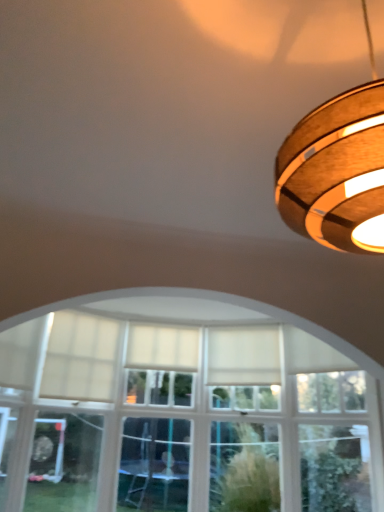
Question: From a real-world perspective, is wooden ring light at upper right physically below white fabric curtain at center, which is counted as the first curtain, starting from the right?

Choices:
 (A) yes
 (B) no

Answer: (B)

Question: From the image's perspective, is wooden ring light at upper right on top of white fabric curtain at center, the 2th curtain when ordered from left to right?

Choices:
 (A) no
 (B) yes

Answer: (B)

Question: Does wooden ring light at upper right have a greater width compared to white fabric curtain at center, the 2th curtain when ordered from left to right?

Choices:
 (A) yes
 (B) no

Answer: (A)

Question: Can you confirm if wooden ring light at upper right is positioned to the left of white fabric curtain at center, which is counted as the first curtain, starting from the right?

Choices:
 (A) no
 (B) yes

Answer: (A)

Question: Does wooden ring light at upper right have a smaller size compared to white fabric curtain at center, the 2th curtain when ordered from left to right?

Choices:
 (A) no
 (B) yes

Answer: (A)

Question: Is white fabric curtain at center, the 2th curtain when ordered from left to right, inside or outside of wooden ring light at upper right?

Choices:
 (A) inside
 (B) outside

Answer: (B)

Question: Based on their sizes in the image, would you say white fabric curtain at center, which is counted as the first curtain, starting from the right, is bigger or smaller than wooden ring light at upper right?

Choices:
 (A) big
 (B) small

Answer: (B)

Question: Would you say white fabric curtain at center, the 2th curtain when ordered from left to right, is to the left or to the right of wooden ring light at upper right in the picture?

Choices:
 (A) left
 (B) right

Answer: (A)

Question: In terms of height, does white fabric curtain at center, which is counted as the first curtain, starting from the right, look taller or shorter compared to wooden ring light at upper right?

Choices:
 (A) tall
 (B) short

Answer: (B)

Question: Based on their positions, is white sheer curtain at center, the second curtain positioned from the right, located to the left or right of white fabric curtain at center, the 2th curtain when ordered from left to right?

Choices:
 (A) right
 (B) left

Answer: (B)

Question: From the image's perspective, is white sheer curtain at center, the second curtain positioned from the right, positioned above or below white fabric curtain at center, which is counted as the first curtain, starting from the right?

Choices:
 (A) below
 (B) above

Answer: (A)

Question: Based on their sizes in the image, would you say white sheer curtain at center, the second curtain positioned from the right, is bigger or smaller than white fabric curtain at center, which is counted as the first curtain, starting from the right?

Choices:
 (A) big
 (B) small

Answer: (B)

Question: In terms of height, does white sheer curtain at center, the second curtain positioned from the right, look taller or shorter compared to white fabric curtain at center, which is counted as the first curtain, starting from the right?

Choices:
 (A) short
 (B) tall

Answer: (B)

Question: Is wooden ring light at upper right wider or thinner than white fabric curtain at center, which is counted as the first curtain, starting from the right?

Choices:
 (A) thin
 (B) wide

Answer: (B)

Question: Is wooden ring light at upper right bigger or smaller than white fabric curtain at center, which is counted as the first curtain, starting from the right?

Choices:
 (A) big
 (B) small

Answer: (A)